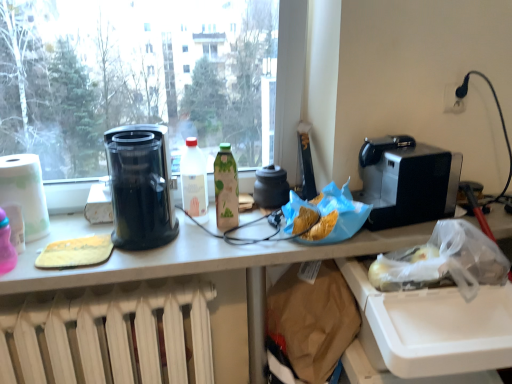
This screenshot has height=384, width=512. Find the location of `vacant point above yellow sponge at left, which is the 2th food from right to left (from a real-world perspective)`. vacant point above yellow sponge at left, which is the 2th food from right to left (from a real-world perspective) is located at coordinates (73, 240).